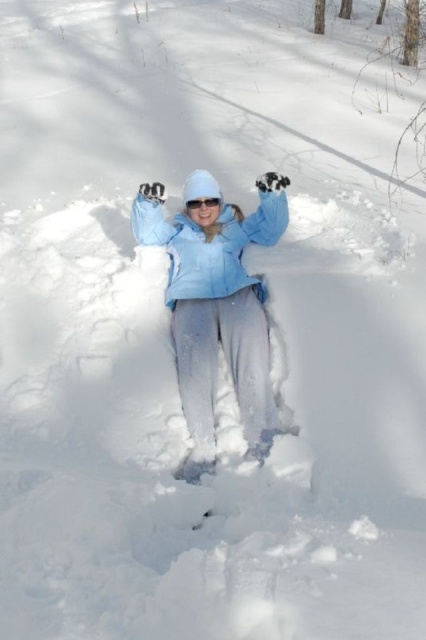
You are a fashion designer observing the winter outfit of the person in the image. You need to determine if the transparent plastic goggles at center can be stored in the light blue fabric at center. Can they fit?

The light blue fabric at center is bigger than transparent plastic goggles at center, so yes, the transparent plastic goggles at center can be stored in the light blue fabric at center because it is larger in size.

You are an observer looking at the snowy landscape. You notice two items at the center of the scene. Which one is closer to the ground, the light blue fabric at center or the matte blue jacket at center?

The light blue fabric at center is positioned under the matte blue jacket at center, so it is closer to the ground.

You are a fashion designer who wants to create a winter outfit. You have the matte blue jacket at center and transparent plastic goggles at center. Which item would you need to adjust in size to ensure they are the same size?

The matte blue jacket at center has a larger size compared to transparent plastic goggles at center, so you would need to adjust the size of the transparent plastic goggles at center to match the larger size of the matte blue jacket at center.